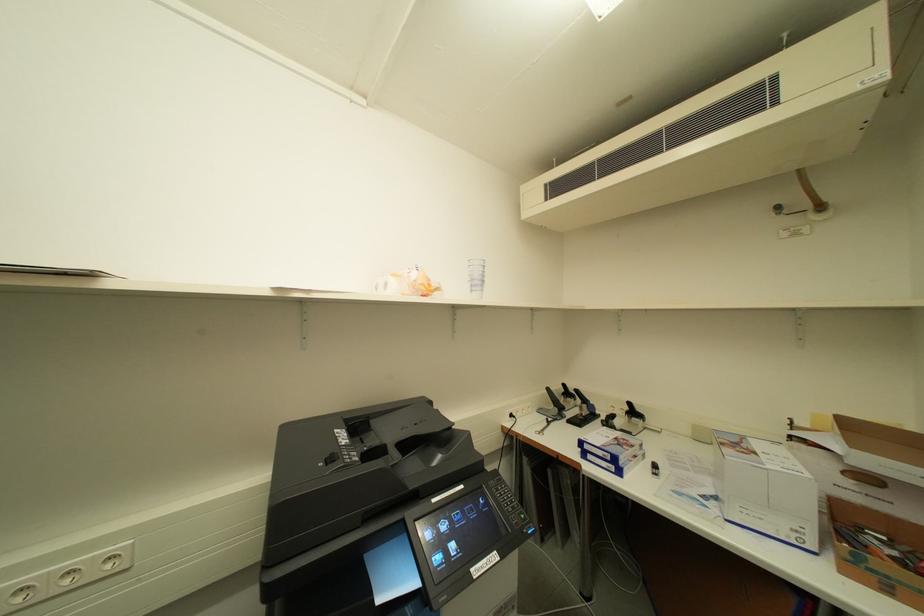
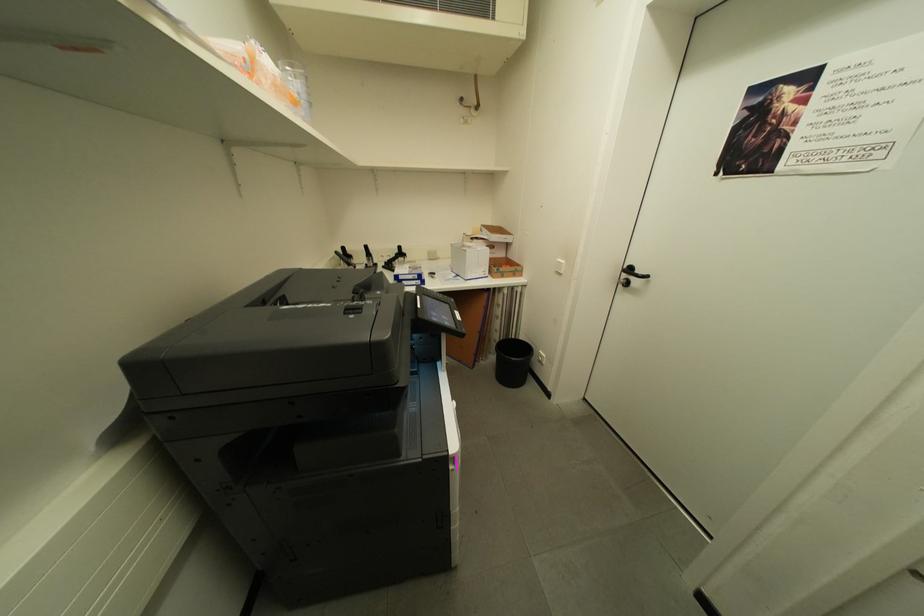
How did the camera likely rotate?

The camera rotated toward right-down.